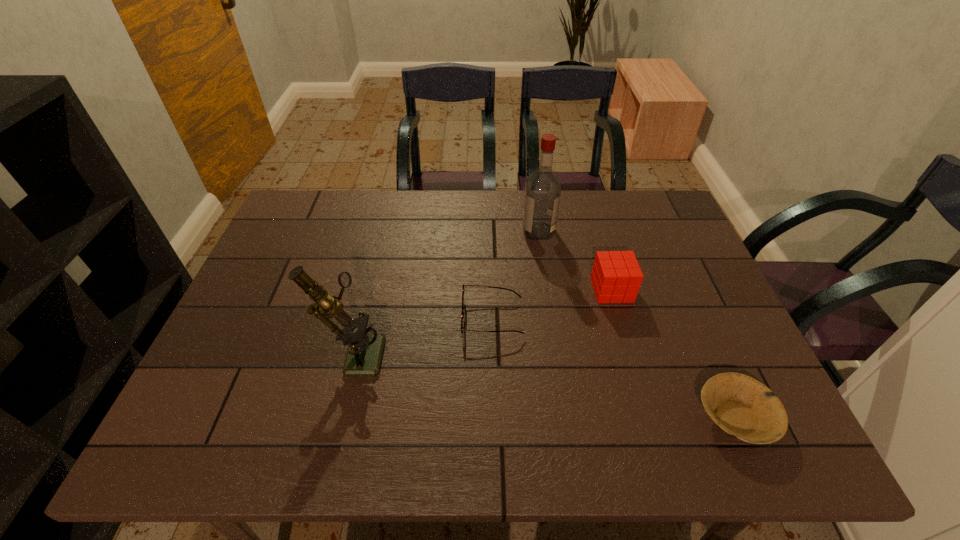
Identify the location of the farthest object. (542, 197).

Find the location of a particular element. The height and width of the screenshot is (540, 960). liquor is located at coordinates (542, 197).

Where is `the leftmost object`? the leftmost object is located at coordinates (364, 355).

This screenshot has width=960, height=540. Find the location of `the third shortest object`. the third shortest object is located at coordinates (616, 277).

Image resolution: width=960 pixels, height=540 pixels. In order to click on cube in this screenshot , I will do `click(616, 277)`.

Where is `the fourth object from right to left`? Image resolution: width=960 pixels, height=540 pixels. the fourth object from right to left is located at coordinates (462, 313).

Image resolution: width=960 pixels, height=540 pixels. I want to click on bowl, so click(742, 406).

Image resolution: width=960 pixels, height=540 pixels. What are the coordinates of `the nearest object` in the screenshot? It's located at [x=742, y=406].

Locate an element on the screen. The width and height of the screenshot is (960, 540). free region located on the front-facing side of the third object from left to right is located at coordinates (413, 231).

Locate an element on the screen. The width and height of the screenshot is (960, 540). vacant space located 0.120m on the front-facing side of the third object from left to right is located at coordinates (484, 231).